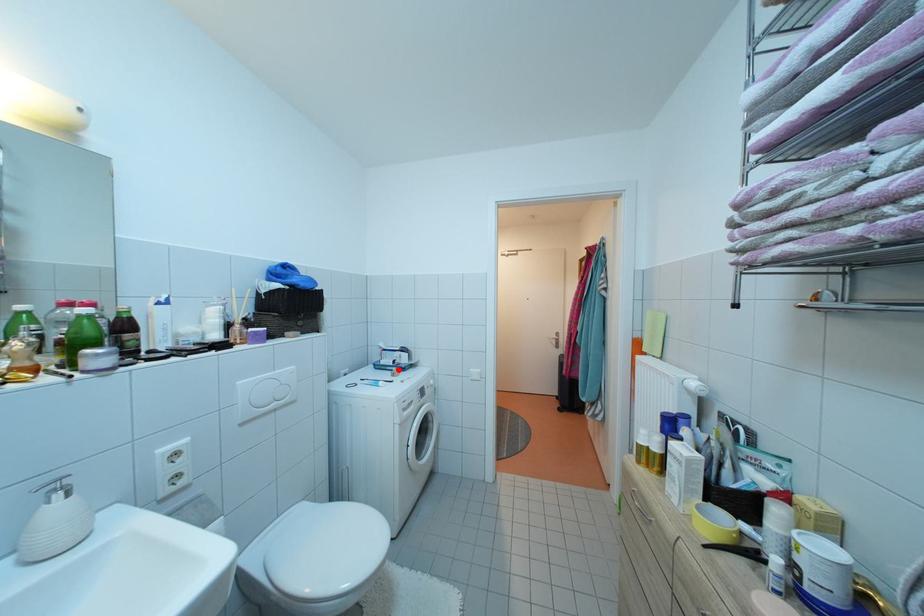
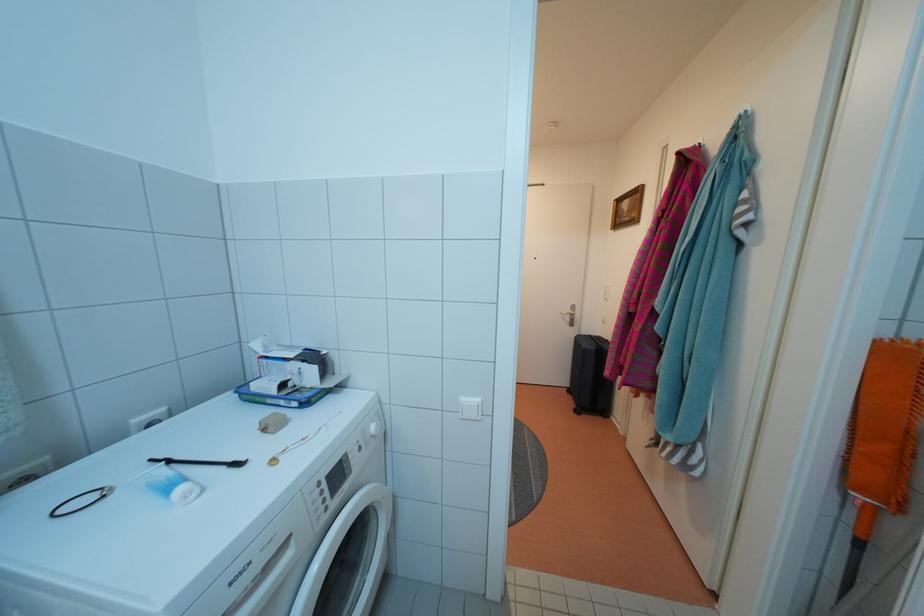
Question: I am providing you with two images of the same scene from different viewpoints. A red point is marked on the first image. Is the red point's position out of view in image 2?

Choices:
 (A) Yes
 (B) No

Answer: (B)